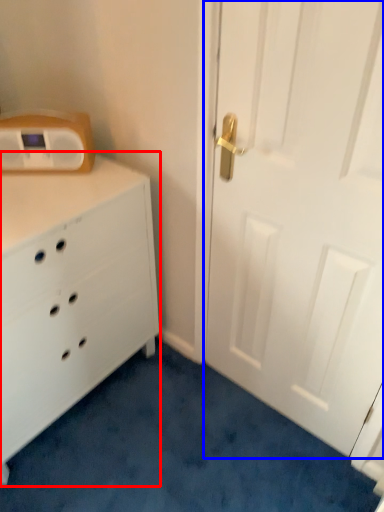
Question: Which of the following is the farthest to the observer, chest of drawers (highlighted by a red box) or door (highlighted by a blue box)?

Choices:
 (A) chest of drawers
 (B) door

Answer: (A)